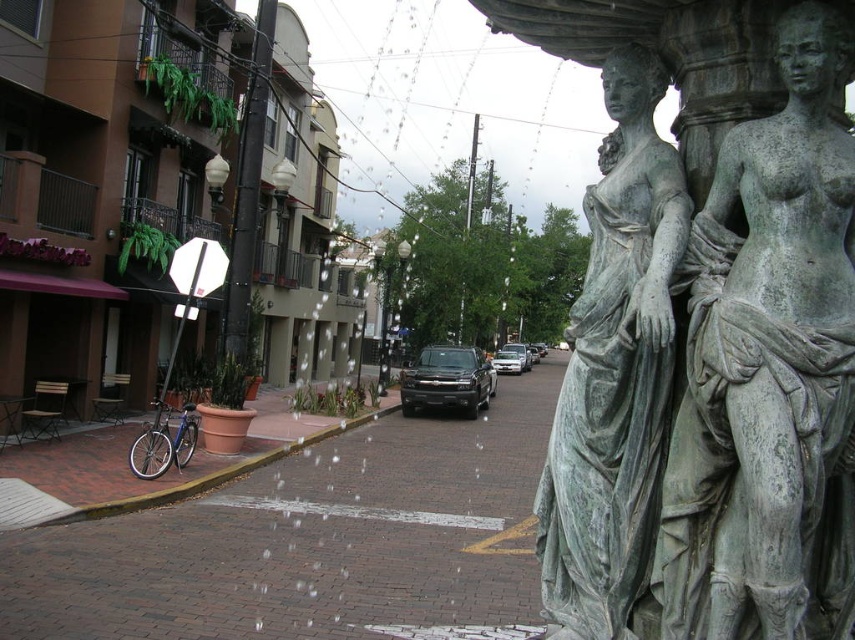
Who is positioned more to the right, green patina statue at right or green patina statue at center?

Positioned to the right is green patina statue at center.

Which is more to the left, green patina statue at right or green patina statue at center?

green patina statue at right is more to the left.

This screenshot has height=640, width=855. Describe the element at coordinates (770, 371) in the screenshot. I see `green patina statue at right` at that location.

Locate an element on the screen. green patina statue at right is located at coordinates (770, 371).

Does green patina statue at right have a smaller size compared to silver metallic bicycle at lower left?

Correct, green patina statue at right occupies less space than silver metallic bicycle at lower left.

Does green patina statue at right have a lesser height compared to silver metallic bicycle at lower left?

No, green patina statue at right is not shorter than silver metallic bicycle at lower left.

Does point (717, 456) come behind point (192, 428)?

No, it is not.

Identify the location of green patina statue at right. (770, 371).

Which is above, shiny black suv at center or silver metallic bicycle at lower left?

shiny black suv at center is above.

Between shiny black suv at center and silver metallic bicycle at lower left, which one appears on the left side from the viewer's perspective?

From the viewer's perspective, silver metallic bicycle at lower left appears more on the left side.

The width and height of the screenshot is (855, 640). Find the location of `shiny black suv at center`. shiny black suv at center is located at coordinates [446, 380].